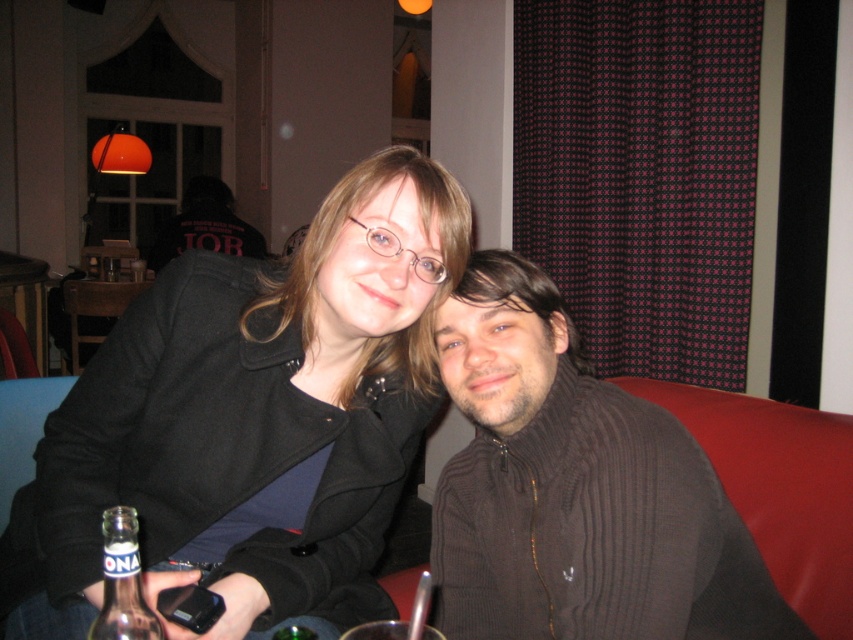
You are a photographer setting up for a group photo. You see the black matte jacket at upper left and the dark brown sweater at right. Which clothing item is positioned higher in the frame?

The black matte jacket at upper left is located above the dark brown sweater at right, so it is positioned higher in the frame.

You are a photographer setting up for a group photo. You need to ensure that the black matte jacket at upper left and the clear glass bottle at lower left are both visible in the frame. Given their sizes, which object should you prioritize keeping closer to the camera to maintain clarity?

The black matte jacket at upper left is larger than the clear glass bottle at lower left, so you should prioritize keeping the clear glass bottle at lower left closer to the camera to ensure both are clearly visible in the frame.